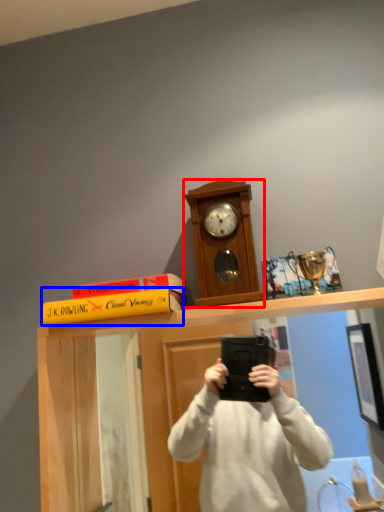
Question: Which point is further to the camera, clock (highlighted by a red box) or book (highlighted by a blue box)?

Choices:
 (A) clock
 (B) book

Answer: (A)